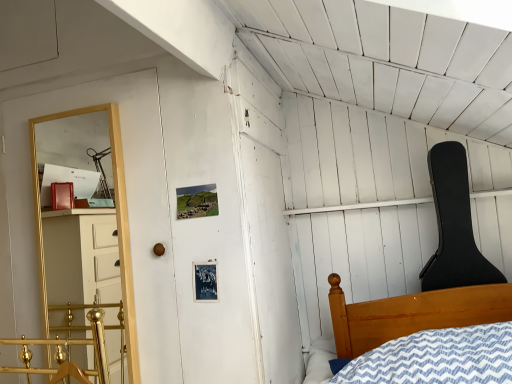
Question: Is gold metallic rail at lower left in front of or behind black hard case guitar at upper right in the image?

Choices:
 (A) behind
 (B) front

Answer: (B)

Question: Is point (116, 329) positioned closer to the camera than point (455, 279)?

Choices:
 (A) closer
 (B) farther

Answer: (B)

Question: Which is farther from the black hard case guitar at upper right?

Choices:
 (A) gold metallic rail at lower left
 (B) gold wooden shelf at left

Answer: (A)

Question: Which is nearer to the gold wooden shelf at left?

Choices:
 (A) black hard case guitar at upper right
 (B) gold metallic rail at lower left

Answer: (B)